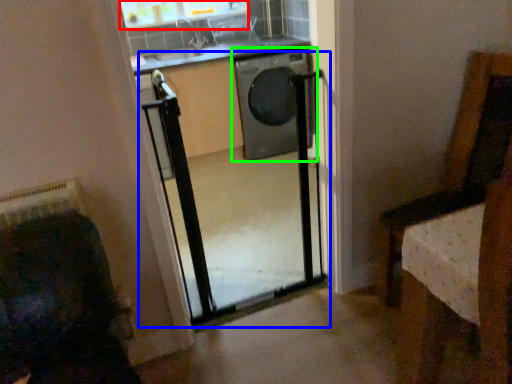
Question: Which object is positioned farthest from window (highlighted by a red box)? Select from screen door (highlighted by a blue box) and washing machine (highlighted by a green box).

Choices:
 (A) screen door
 (B) washing machine

Answer: (A)